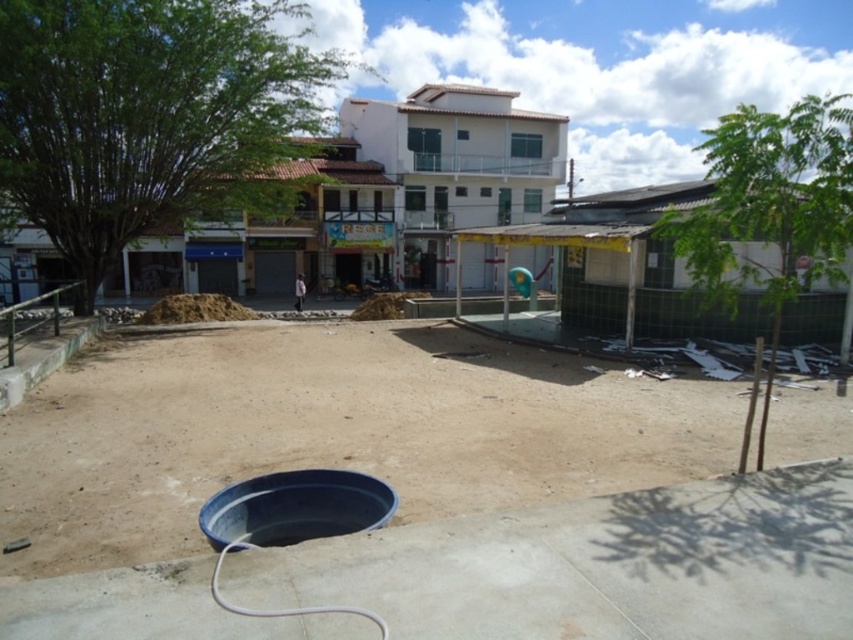
You are standing at the circular blue plastic basin in the foreground. You need to reach a point that is 24.75 feet away from you. Can you determine if the point at coordinates point (589, 449) is the correct destination?

Yes, the point at coordinates point (589, 449) is the correct destination because it is exactly 24.75 feet away from the viewer, which matches the required distance.